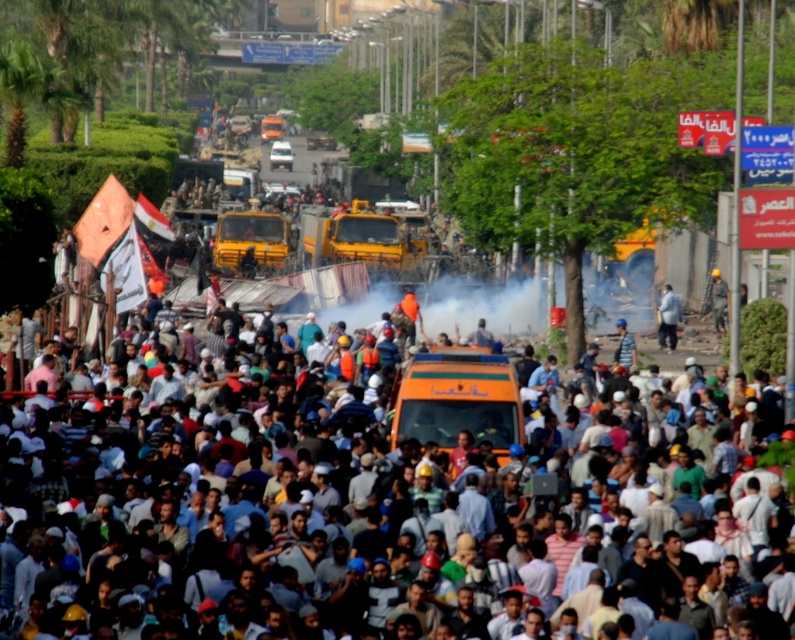
Is light blue fabric shirt at center above yellow hard hat at center?

Incorrect, light blue fabric shirt at center is not positioned above yellow hard hat at center.

Describe the element at coordinates (669, 317) in the screenshot. The image size is (795, 640). I see `light blue fabric shirt at center` at that location.

The width and height of the screenshot is (795, 640). Find the location of `light blue fabric shirt at center`. light blue fabric shirt at center is located at coordinates (669, 317).

At what (x,y) coordinates should I click in order to perform the action: click on light blue fabric shirt at center. Please return your answer as a coordinate pair (x, y). The image size is (795, 640). Looking at the image, I should click on (669, 317).

Who is more forward, (359, 317) or (677, 321)?

Point (677, 321)

Can you confirm if white dusty smoke at center is shorter than light blue fabric shirt at center?

No, white dusty smoke at center is not shorter than light blue fabric shirt at center.

Identify the location of white dusty smoke at center. Image resolution: width=795 pixels, height=640 pixels. (481, 305).

Does orange fabric crowd at center appear over yellow hard hat at center?

Actually, orange fabric crowd at center is below yellow hard hat at center.

Measure the distance from orange fabric crowd at center to yellow hard hat at center.

orange fabric crowd at center is 25.87 meters from yellow hard hat at center.

Is point (22, 600) less distant than point (718, 292)?

That is True.

At what (x,y) coordinates should I click in order to perform the action: click on orange fabric crowd at center. Please return your answer as a coordinate pair (x, y). The image size is (795, 640). Looking at the image, I should click on (242, 524).